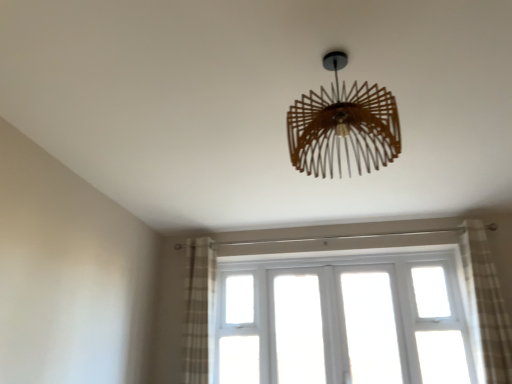
Question: Considering the relative sizes of white wooden window at center and wooden chandelier at center in the image provided, is white wooden window at center thinner than wooden chandelier at center?

Choices:
 (A) yes
 (B) no

Answer: (A)

Question: From a real-world perspective, is white wooden window at center located beneath wooden chandelier at center?

Choices:
 (A) no
 (B) yes

Answer: (B)

Question: From a real-world perspective, is white wooden window at center physically above wooden chandelier at center?

Choices:
 (A) yes
 (B) no

Answer: (B)

Question: Is white wooden window at center with wooden chandelier at center?

Choices:
 (A) no
 (B) yes

Answer: (A)

Question: Can you confirm if white wooden window at center is wider than wooden chandelier at center?

Choices:
 (A) no
 (B) yes

Answer: (A)

Question: Is white wooden window at center to the right of wooden chandelier at center from the viewer's perspective?

Choices:
 (A) no
 (B) yes

Answer: (B)

Question: Can you confirm if wooden chandelier at center is smaller than white wooden window at center?

Choices:
 (A) no
 (B) yes

Answer: (B)

Question: Is wooden chandelier at center at the right side of white wooden window at center?

Choices:
 (A) yes
 (B) no

Answer: (B)

Question: Is white wooden window at center completely or partially inside wooden chandelier at center?

Choices:
 (A) no
 (B) yes

Answer: (A)

Question: From the image's perspective, is wooden chandelier at center located beneath white wooden window at center?

Choices:
 (A) yes
 (B) no

Answer: (B)

Question: Considering the relative positions of wooden chandelier at center and white wooden window at center in the image provided, is wooden chandelier at center to the left of white wooden window at center from the viewer's perspective?

Choices:
 (A) yes
 (B) no

Answer: (A)

Question: Can you confirm if wooden chandelier at center is shorter than white wooden window at center?

Choices:
 (A) no
 (B) yes

Answer: (B)

Question: From a real-world perspective, is wooden chandelier at center on top of plaid fabric curtain at right, the 1th curtain viewed from the right?

Choices:
 (A) yes
 (B) no

Answer: (A)